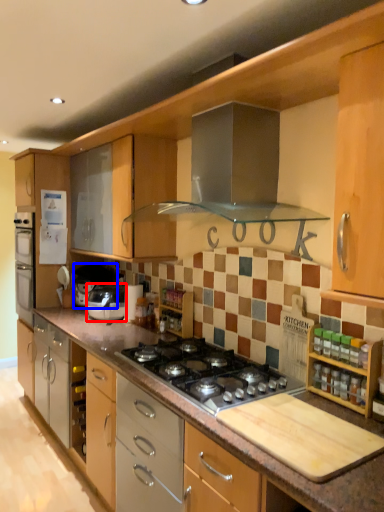
Question: Which of the following is the closest to the observer, home appliance (highlighted by a red box) or appliance (highlighted by a blue box)?

Choices:
 (A) home appliance
 (B) appliance

Answer: (A)